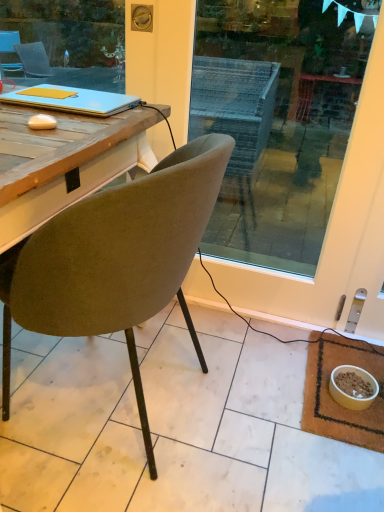
Where is `vacant point above brown woven mat at lower right (from a real-world perspective)`? This screenshot has height=512, width=384. vacant point above brown woven mat at lower right (from a real-world perspective) is located at coordinates (337, 390).